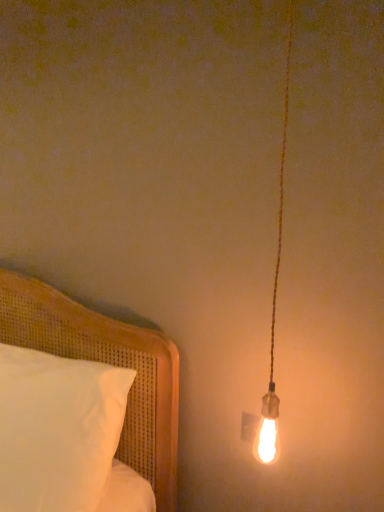
Question: Is point click(x=268, y=407) closer or farther from the camera than point click(x=21, y=295)?

Choices:
 (A) closer
 (B) farther

Answer: (A)

Question: Do you think matte gold bulb at right is within white cotton pillow at left, or outside of it?

Choices:
 (A) inside
 (B) outside

Answer: (B)

Question: From the image's perspective, is matte gold bulb at right located above or below white cotton pillow at left?

Choices:
 (A) above
 (B) below

Answer: (A)

Question: Based on their positions, is white cotton pillow at left located to the left or right of matte gold bulb at right?

Choices:
 (A) left
 (B) right

Answer: (A)

Question: From the image's perspective, is white cotton pillow at left located above or below matte gold bulb at right?

Choices:
 (A) above
 (B) below

Answer: (B)

Question: Is point (9, 310) positioned closer to the camera than point (269, 373)?

Choices:
 (A) farther
 (B) closer

Answer: (A)

Question: Is white cotton pillow at left taller or shorter than matte gold bulb at right?

Choices:
 (A) tall
 (B) short

Answer: (B)